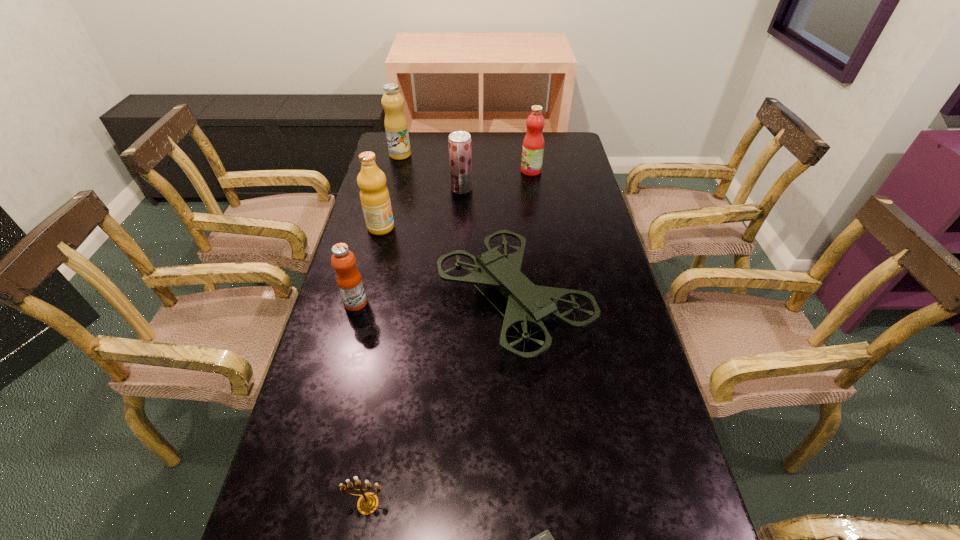
Image resolution: width=960 pixels, height=540 pixels. In order to click on vacant position located on the front label of the farthest fruit juice in this screenshot , I will do `click(480, 155)`.

Locate an element on the screen. The image size is (960, 540). free space located 0.150m on the front label of the second nearest fruit juice is located at coordinates (x=440, y=227).

The width and height of the screenshot is (960, 540). What are the coordinates of `vacant space situated 0.330m on the front label of the second farthest object` in the screenshot? It's located at (436, 171).

Find the location of a particular element. The width and height of the screenshot is (960, 540). vacant region located 0.280m on the front label of the second farthest object is located at coordinates (448, 171).

Locate an element on the screen. This screenshot has height=540, width=960. free space located 0.380m on the front label of the second farthest object is located at coordinates (423, 171).

Locate an element on the screen. The width and height of the screenshot is (960, 540). free space located on the back of the drone is located at coordinates (505, 188).

Locate an element on the screen. free space located 0.190m on the left of the third farthest fruit juice is located at coordinates (399, 188).

Image resolution: width=960 pixels, height=540 pixels. Find the location of `vacant position located 0.170m on the front label of the nearest fruit juice`. vacant position located 0.170m on the front label of the nearest fruit juice is located at coordinates (428, 303).

At what (x,y) coordinates should I click in order to perform the action: click on vacant space situated on the left of the fifth object from right to left. Please return your answer as a coordinate pair (x, y). Looking at the image, I should click on (308, 504).

Image resolution: width=960 pixels, height=540 pixels. Identify the location of object situated at the far edge. (396, 127).